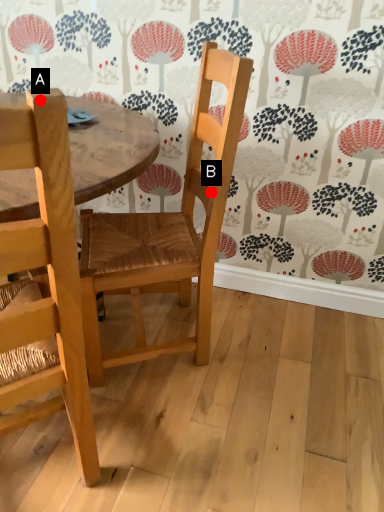
Question: Two points are circled on the image, labeled by A and B beside each circle. Which of the following is the closest to the observer?

Choices:
 (A) A is closer
 (B) B is closer

Answer: (A)